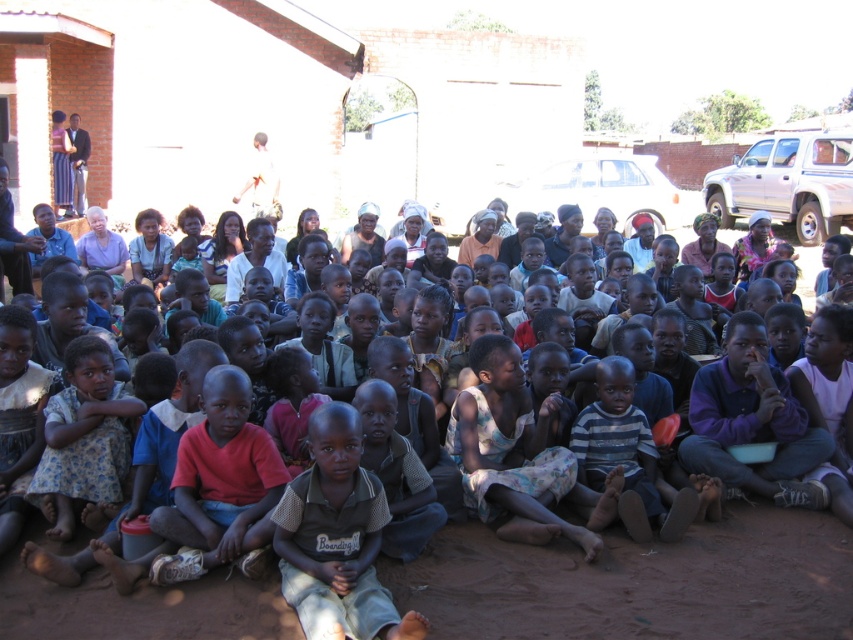
Is brown dirt field at center wider than light brown woven shirt at center?

Correct, the width of brown dirt field at center exceeds that of light brown woven shirt at center.

Which is below, brown dirt field at center or light brown woven shirt at center?

brown dirt field at center is below.

I want to click on brown dirt field at center, so click(639, 580).